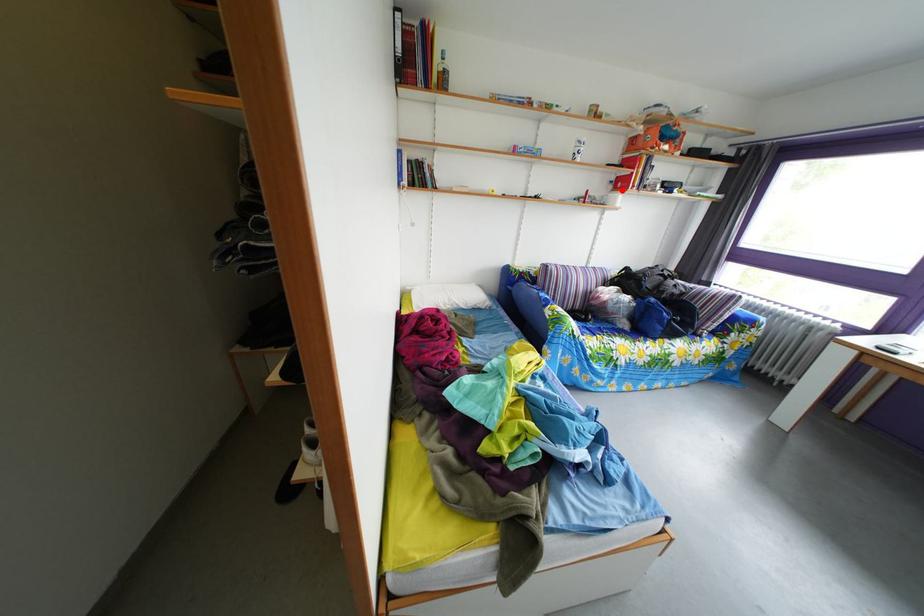
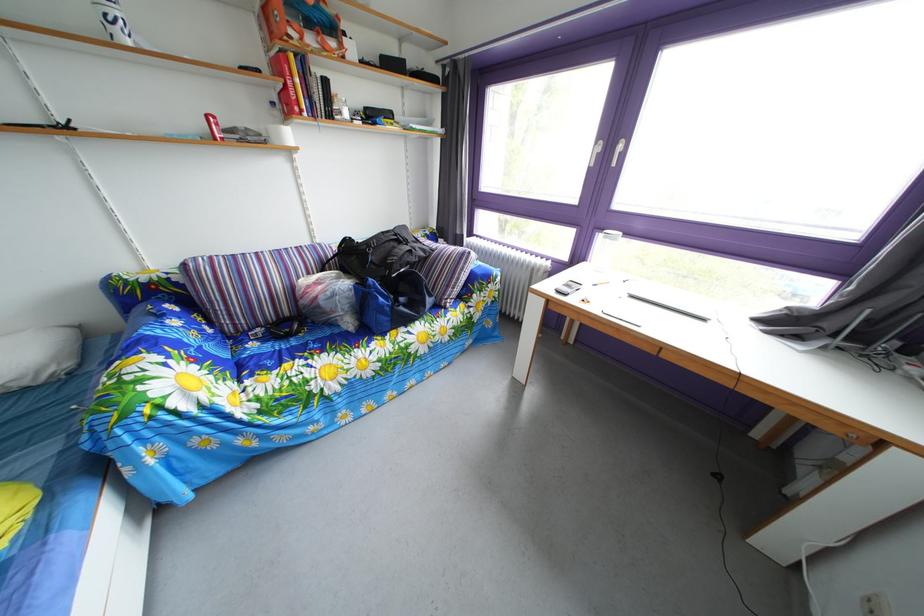
The point at the highlighted location is marked in the first image. Where is the corresponding point in the second image?

(284, 111)